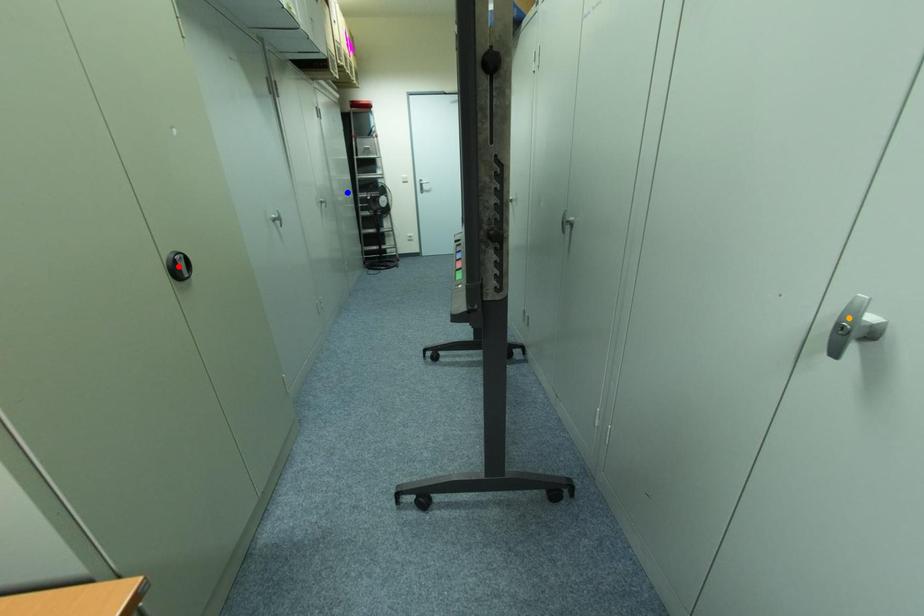
Order these from nearest to farthest:
orange point | blue point | red point

orange point
red point
blue point